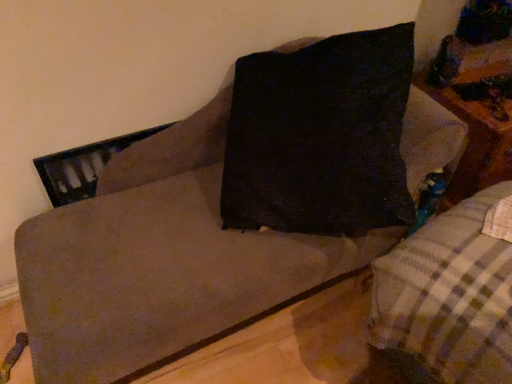
Question: From a real-world perspective, relative to plaid fabric couch at center, is wooden table at right vertically above or below?

Choices:
 (A) above
 (B) below

Answer: (A)

Question: Is wooden table at right situated inside plaid fabric couch at center or outside?

Choices:
 (A) outside
 (B) inside

Answer: (A)

Question: Would you say wooden table at right is to the left or to the right of plaid fabric couch at center in the picture?

Choices:
 (A) right
 (B) left

Answer: (A)

Question: Relative to wooden table at right, is plaid fabric couch at center in front or behind?

Choices:
 (A) behind
 (B) front

Answer: (B)

Question: In the image, is plaid fabric couch at center on the left side or the right side of wooden table at right?

Choices:
 (A) right
 (B) left

Answer: (B)

Question: Does point (449, 238) appear closer or farther from the camera than point (492, 139)?

Choices:
 (A) farther
 (B) closer

Answer: (B)

Question: In terms of size, does plaid fabric couch at center appear bigger or smaller than wooden table at right?

Choices:
 (A) big
 (B) small

Answer: (A)